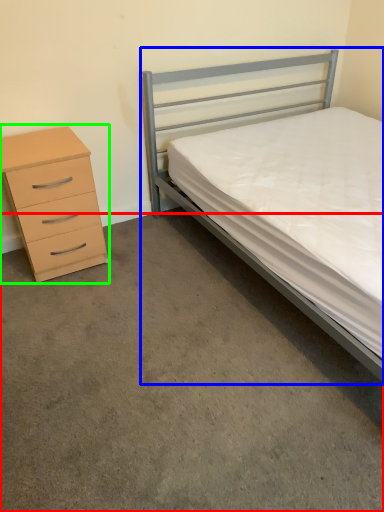
Question: Based on their relative distances, which object is farther from concrete (highlighted by a red box)? Choose from bed (highlighted by a blue box) and chest of drawers (highlighted by a green box).

Choices:
 (A) bed
 (B) chest of drawers

Answer: (A)